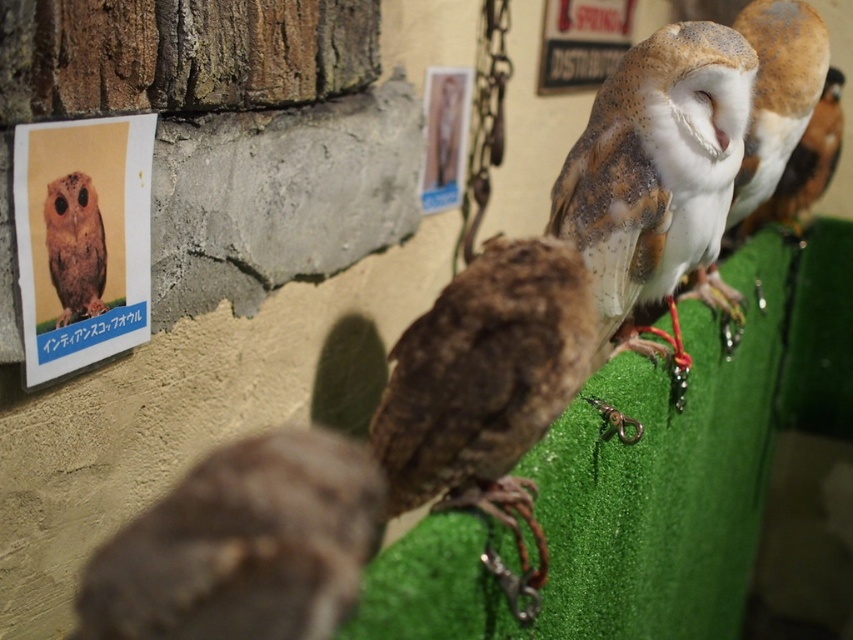
Question: Among these objects, which one is farthest from the camera?

Choices:
 (A) speckled feathered owl at upper right
 (B) brown fuzzy owl at center

Answer: (A)

Question: Which point is farther from the camera taking this photo?

Choices:
 (A) (86, 237)
 (B) (685, 196)
 (C) (216, 529)

Answer: (B)

Question: Can you confirm if brown fuzzy owl at center is wider than speckled feathered owl at upper right?

Choices:
 (A) yes
 (B) no

Answer: (B)

Question: Does brown fuzzy owl at center have a greater width compared to speckled feathered owl at upper right?

Choices:
 (A) no
 (B) yes

Answer: (A)

Question: Estimate the real-world distances between objects in this image. Which object is closer to the speckled feathered owl at upper right?

Choices:
 (A) brown fuzzy owl at center
 (B) brown speckled owl at upper left

Answer: (A)

Question: Is the position of brown fuzzy owl at center more distant than that of brown speckled owl at upper left?

Choices:
 (A) yes
 (B) no

Answer: (B)